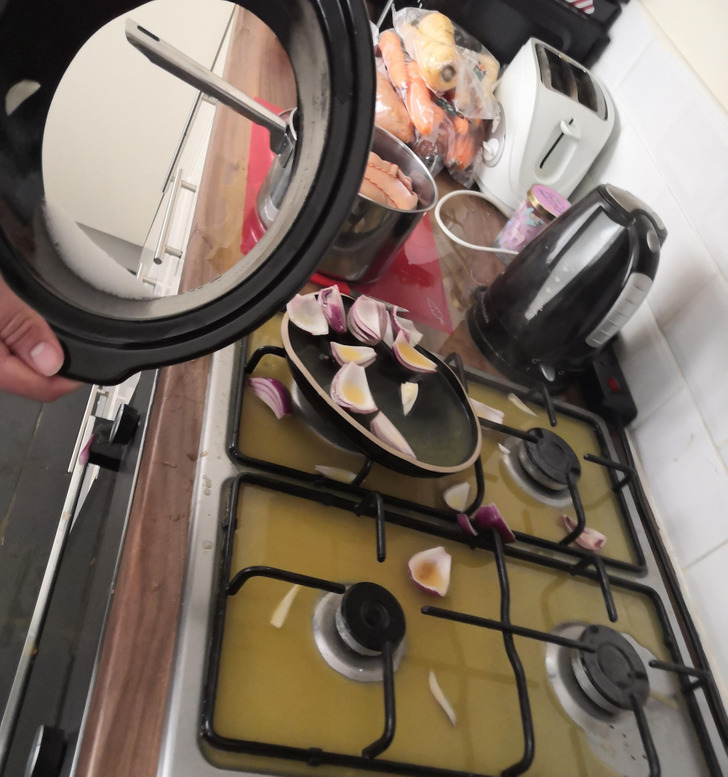
The image size is (728, 777). I want to click on gas heating element, so coord(164,231), coord(375,608), coord(542,448), coord(619,667).